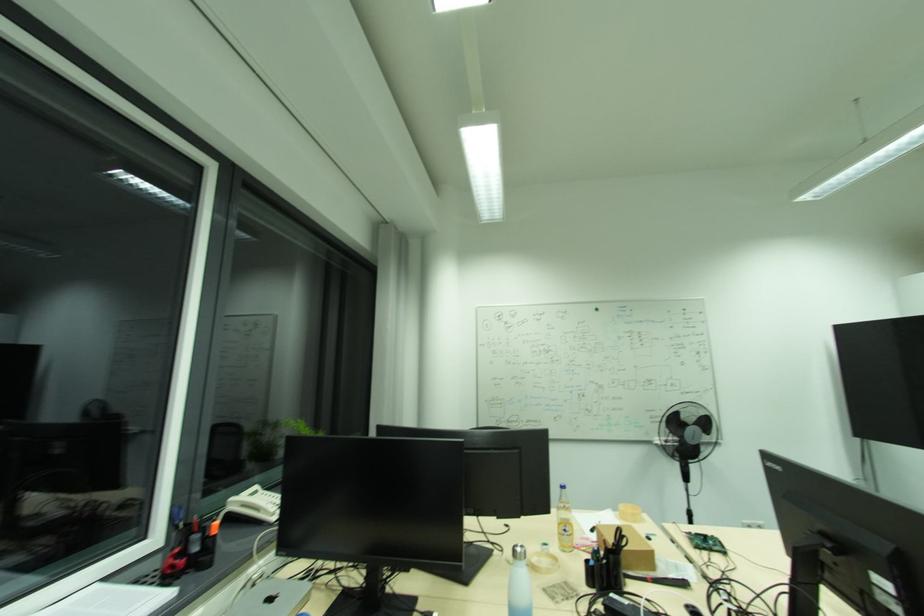
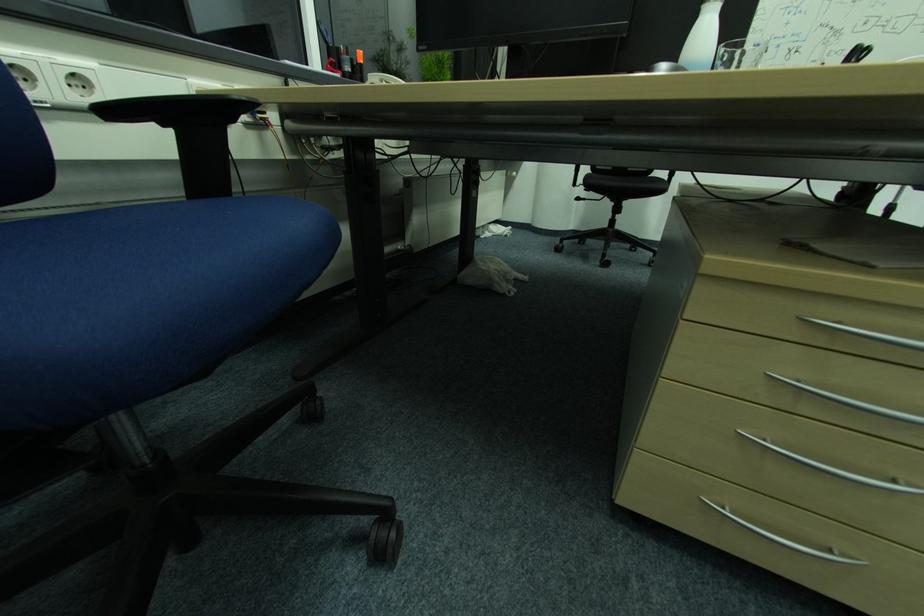
The first image is from the beginning of the video and the second image is from the end. How did the camera likely rotate when shooting the video?

The camera rotated toward left-down.